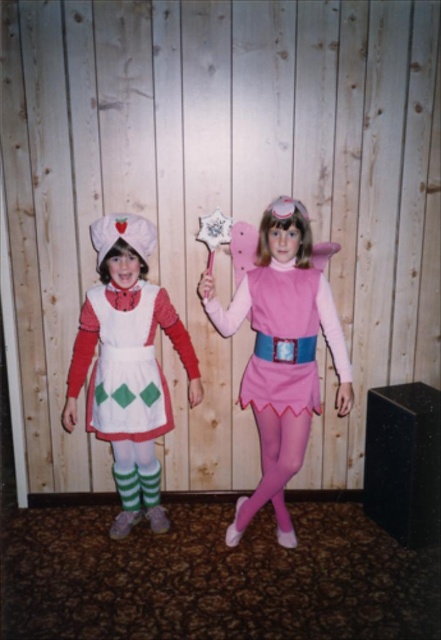
Question: Which object is positioned farthest from the white matte apron at left?

Choices:
 (A) matte white dress at left
 (B) pink satin dress at center
 (C) matte white apron at center

Answer: (B)

Question: Can you confirm if matte white dress at left is positioned above matte white apron at center?

Choices:
 (A) no
 (B) yes

Answer: (B)

Question: Can you confirm if white matte apron at left is bigger than pink satin dress at center?

Choices:
 (A) no
 (B) yes

Answer: (B)

Question: Which point is closer to the camera?

Choices:
 (A) [x=247, y=372]
 (B) [x=79, y=323]

Answer: (B)

Question: In this image, where is matte white dress at left located relative to white matte apron at left?

Choices:
 (A) above
 (B) below

Answer: (B)

Question: Which point appears closest to the camera in this image?

Choices:
 (A) (100, 376)
 (B) (138, 424)
 (C) (291, 404)

Answer: (C)